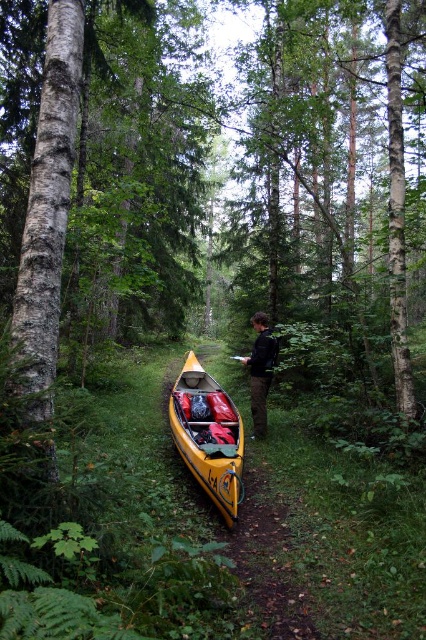
You are standing at the point marked as point (207, 436) in the forest. What object is located exactly at that point?

The yellow matte canoe at center is located exactly at point (207, 436).

You are a hiker planning to carry both the black fabric person at center and the wooden paddle at center. Which object should you pick up first to avoid stepping on the other?

You should pick up the wooden paddle at center first because the black fabric person at center is above it, so reaching the paddle underneath would be easier without needing to move the person.

You are planning to carry both the yellow matte canoe at center and the wooden paddle at center through a narrow forest path. Which item should you carry first to ensure easier passage?

The wooden paddle at center is smaller in size than the yellow matte canoe at center, so you should carry the wooden paddle at center first to navigate the narrow path more easily.